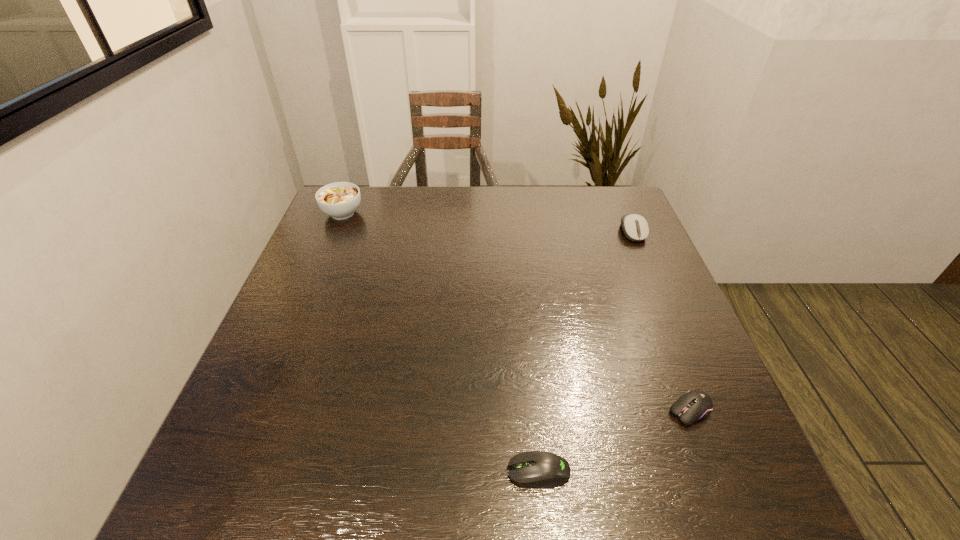
In order to click on free location at the near edge of the desktop in this screenshot , I will do `click(504, 495)`.

At what (x,y) coordinates should I click in order to perform the action: click on free location at the left edge. Please return your answer as a coordinate pair (x, y). Looking at the image, I should click on (277, 393).

In order to click on vacant position at the right edge of the desktop in this screenshot , I will do `click(638, 247)`.

In the image, there is a desktop. Identify the location of vacant area at the far right corner. This screenshot has height=540, width=960. (576, 185).

Identify the location of free region at the near right corner of the desktop. (707, 497).

The width and height of the screenshot is (960, 540). In order to click on empty space that is in between the third farthest object and the third shortest object in this screenshot , I will do `click(661, 321)`.

You are a GUI agent. You are given a task and a screenshot of the screen. Output one action in this format:
    pyautogui.click(x=<x>, y=<y>)
    Task: Click on the vacant region between the second nearest object and the tallest object
    
    Given the screenshot: What is the action you would take?
    pyautogui.click(x=516, y=312)

Find the location of a particular element. Image resolution: width=960 pixels, height=540 pixels. empty location between the nearest object and the second farthest computer mouse is located at coordinates (614, 441).

In order to click on free area in between the tallest computer mouse and the soup bowl in this screenshot , I will do `click(488, 222)`.

The width and height of the screenshot is (960, 540). Identify the location of vacant space that is in between the second nearest computer mouse and the farthest computer mouse. (661, 321).